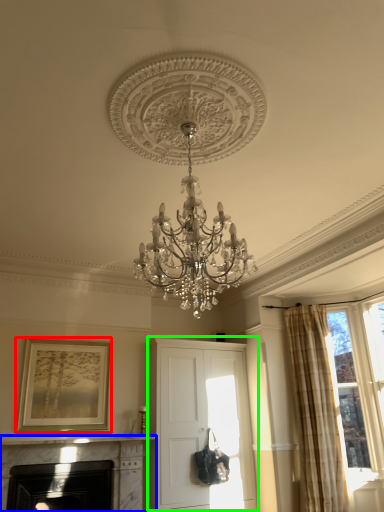
Question: Which object is positioned farthest from picture frame (highlighted by a red box)? Select from fireplace (highlighted by a blue box) and cabinetry (highlighted by a green box).

Choices:
 (A) fireplace
 (B) cabinetry

Answer: (B)